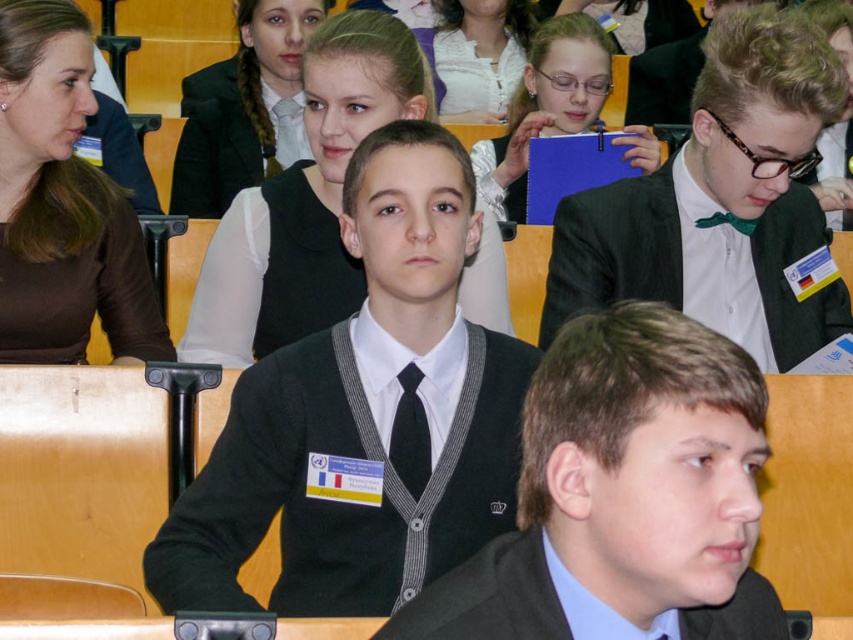
Is matte black sweater at center below black pinstripe tie at center?

Yes.

Who is higher up, matte black sweater at center or black pinstripe tie at center?

black pinstripe tie at center is above.

Is point (473, 602) farther from camera compared to point (404, 384)?

No, it is in front of (404, 384).

Where is `matte black sweater at center`? The height and width of the screenshot is (640, 853). matte black sweater at center is located at coordinates (624, 496).

Who is positioned more to the right, matte black sweater at center or green satin bow tie at upper right?

green satin bow tie at upper right

Does point (712, 540) come farther from viewer compared to point (618, 204)?

That is False.

This screenshot has height=640, width=853. Find the location of `matte black sweater at center`. matte black sweater at center is located at coordinates (624, 496).

Is point (386, 380) in front of point (405, 416)?

No, (386, 380) is further to viewer.

Measure the distance between point (438, 216) and camera.

The distance of point (438, 216) from camera is 3.23 meters.

You are a GUI agent. You are given a task and a screenshot of the screen. Output one action in this format:
    pyautogui.click(x=<x>, y=<y>)
    Task: Click on the black wool sweater at center
    
    Given the screenshot: What is the action you would take?
    pyautogui.click(x=363, y=416)

The width and height of the screenshot is (853, 640). In order to click on black wool sweater at center in this screenshot , I will do `click(363, 416)`.